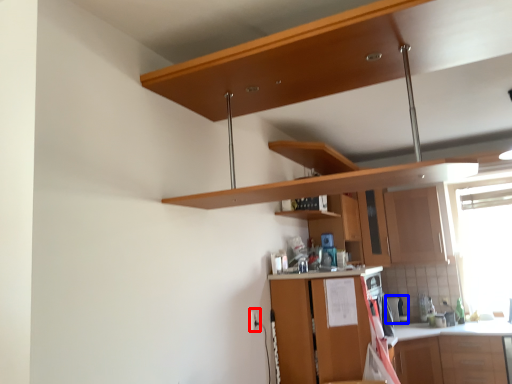
Question: Which of the following is the closest to the observer, electric outlet (highlighted by a red box) or appliance (highlighted by a blue box)?

Choices:
 (A) electric outlet
 (B) appliance

Answer: (A)